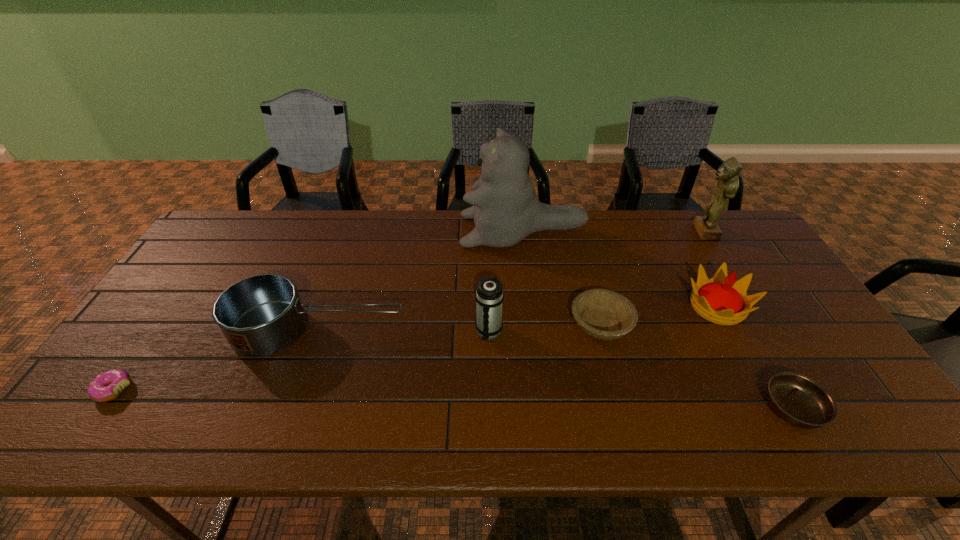
This screenshot has height=540, width=960. Identify the location of the tallest object. (505, 209).

This screenshot has width=960, height=540. Find the location of `figurine`. figurine is located at coordinates (x=706, y=226).

Find the location of a particular element. thermos bottle is located at coordinates (489, 296).

At what (x,y) coordinates should I click in order to perform the action: click on crown. Please return your answer as a coordinate pair (x, y). The height and width of the screenshot is (540, 960). Looking at the image, I should click on (722, 300).

Find the location of a particular element. The image size is (960, 540). saucepan is located at coordinates (261, 315).

The image size is (960, 540). What are the coordinates of `the second object from left to right` in the screenshot? It's located at (261, 315).

At what (x,y) coordinates should I click in order to perform the action: click on bowl. Please return your answer as a coordinate pair (x, y). Looking at the image, I should click on (604, 314).

Locate an element on the screen. soup bowl is located at coordinates (797, 399).

Locate an element on the screen. The width and height of the screenshot is (960, 540). the shortest object is located at coordinates (107, 386).

Find the location of a particular element. The image size is (960, 540). doughnut is located at coordinates (107, 386).